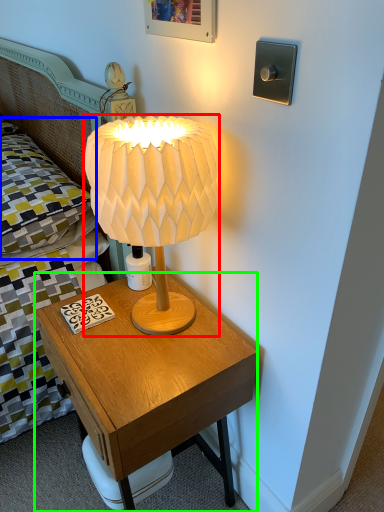
Question: Which is nearer to the lamp (highlighted by a red box)? pillow (highlighted by a blue box) or nightstand (highlighted by a green box).

Choices:
 (A) pillow
 (B) nightstand

Answer: (B)